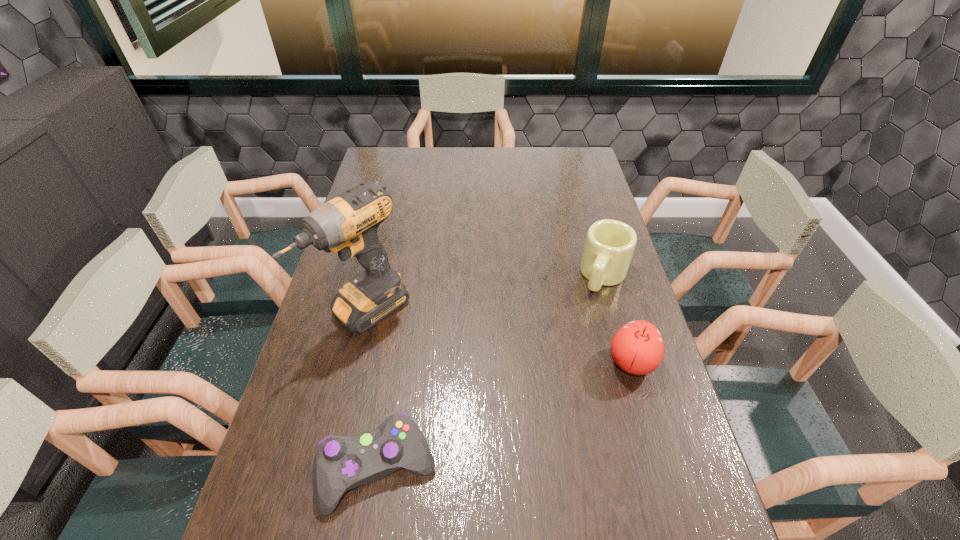
This screenshot has width=960, height=540. I want to click on free spot between the mug and the control, so click(x=492, y=372).

Identify the location of vacant space in between the apple and the control. The width and height of the screenshot is (960, 540). (505, 416).

Locate an element on the screen. This screenshot has height=540, width=960. vacant area that lies between the control and the mug is located at coordinates (492, 372).

The width and height of the screenshot is (960, 540). What are the coordinates of `free space between the tallest object and the mug` in the screenshot? It's located at (485, 293).

Select which object is the third closest to the shortest object. Please provide its 2D coordinates. Your answer should be formatted as a tuple, i.e. [(x, y)], where the tuple contains the x and y coordinates of a point satisfying the conditions above.

[(609, 246)]

Where is `object that is the third closest to the apple`? object that is the third closest to the apple is located at coordinates (348, 224).

The height and width of the screenshot is (540, 960). Identify the location of vacant space that satisfies the following two spatial constraints: 1. on the front side of the control; 2. on the left side of the tallest object. (327, 469).